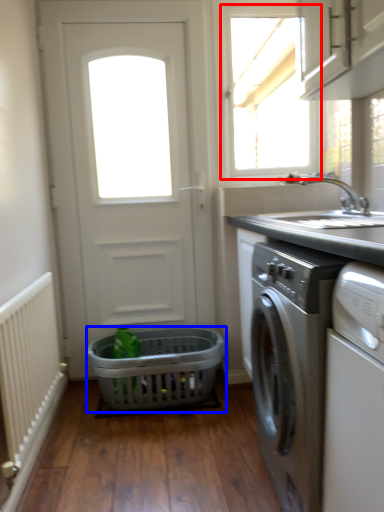
Question: Which object is further to the camera taking this photo, window (highlighted by a red box) or basket (highlighted by a blue box)?

Choices:
 (A) window
 (B) basket

Answer: (A)